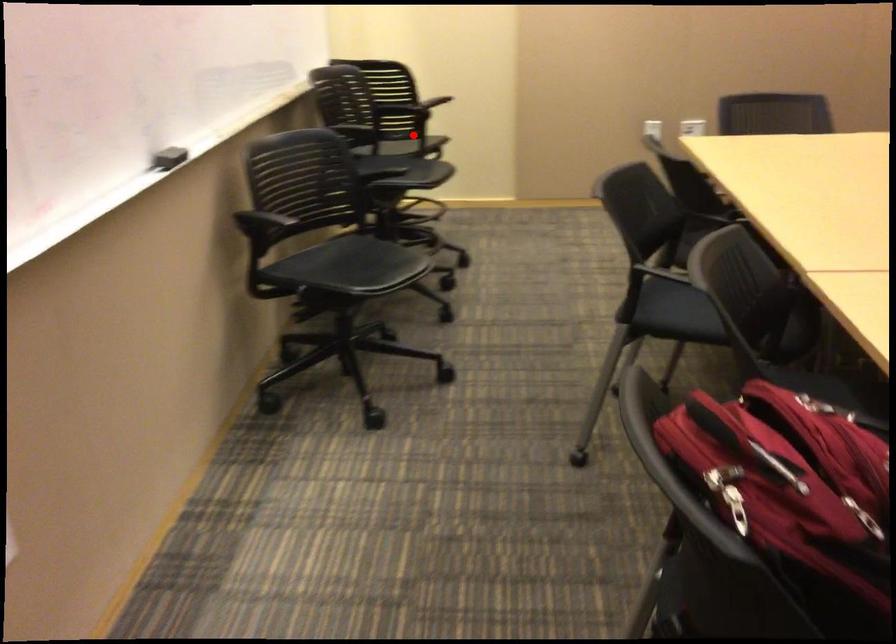
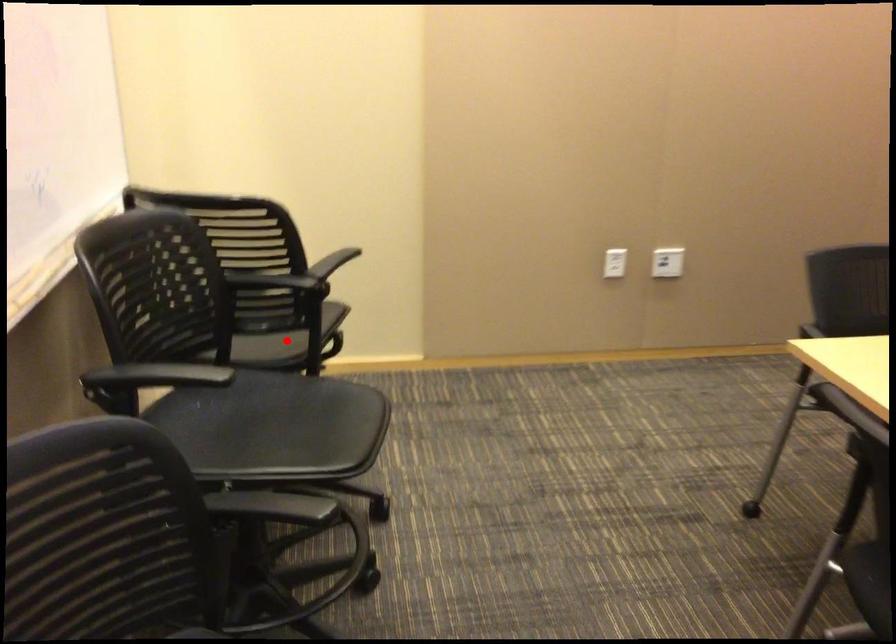
I am providing you with two images of the same scene from different viewpoints. A red point is marked on the first image and another point is marked on the second image. Are the points marked in image1 and image2 representing the same 3D position?

Yes